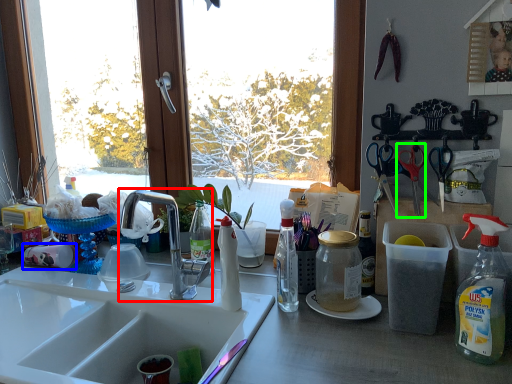
Question: Which object is positioned farthest from tap (highlighted by a red box)? Select from coffee cup (highlighted by a blue box) and scissors (highlighted by a green box).

Choices:
 (A) coffee cup
 (B) scissors

Answer: (B)